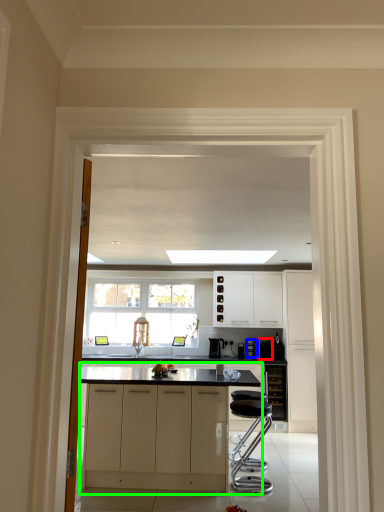
Question: Which object is the farthest from appliance (highlighted by a red box)? Choose among these: appliance (highlighted by a blue box) or cabinetry (highlighted by a green box).

Choices:
 (A) appliance
 (B) cabinetry

Answer: (B)